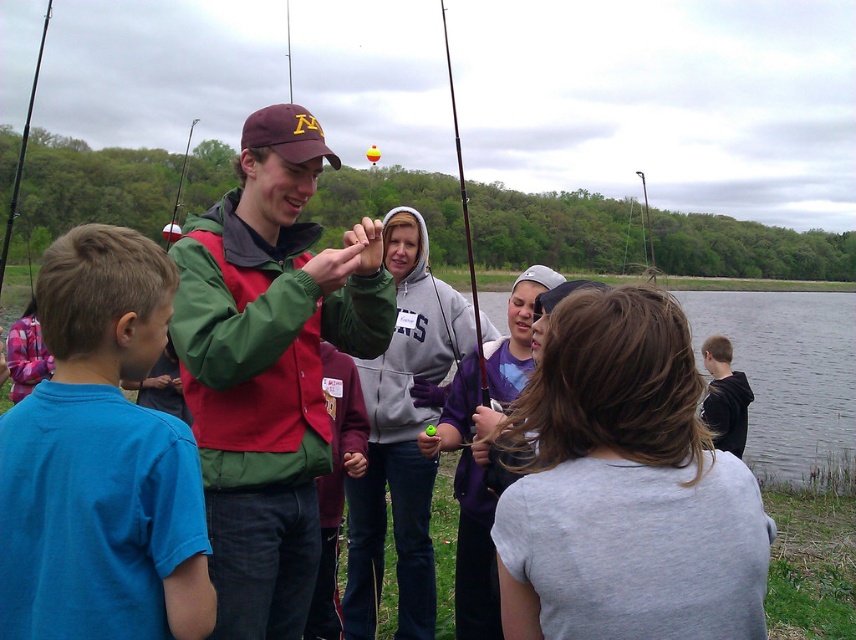
You are a photographer standing in the scene wanting to take a photo that includes both the green fabric jacket at center and the green plastic fishing pole at upper left. Which object should you focus on first to ensure both are in clear focus?

You should focus on the green fabric jacket at center first because it is closer to the viewer than the green plastic fishing pole at upper left, so focusing on the closer object ensures both will be in focus when using a shallow depth of field.

You are standing in the scene and want to take a photo of both point (727, 356) and point (648, 244). Which point should you focus on first to ensure both are in focus?

You should focus on point (648, 244) first because it is farther from the camera than point (727, 356). By focusing on the farther point, the depth of field will include the closer point as well.

You are a photographer trying to capture a clear shot of the green fabric jacket at center and the wooden fishing pole at center. Since the camera can only focus on one object at a time, which object should you focus on first to ensure it appears sharp in the photo?

The green fabric jacket at center is thinner than the wooden fishing pole at center, so you should focus on the wooden fishing pole at center first because thinner objects are harder to focus on and require precise adjustment.